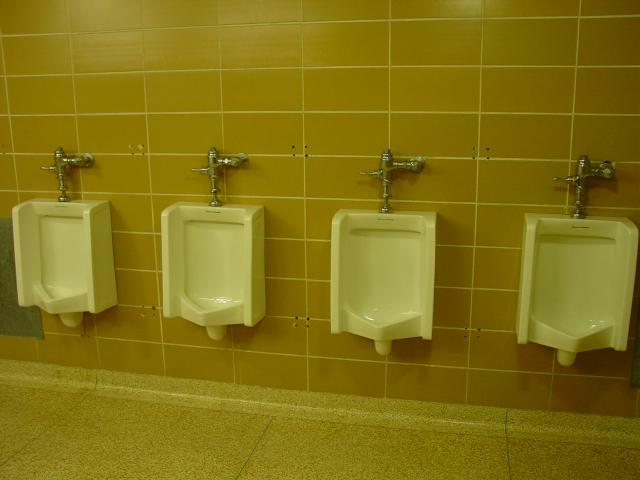
You are a GUI agent. You are given a task and a screenshot of the screen. Output one action in this format:
    pyautogui.click(x=<x>, y=<y>)
    Task: Click on the urinals
    
    Given the screenshot: What is the action you would take?
    pyautogui.click(x=81, y=235), pyautogui.click(x=188, y=269), pyautogui.click(x=400, y=271), pyautogui.click(x=596, y=303)